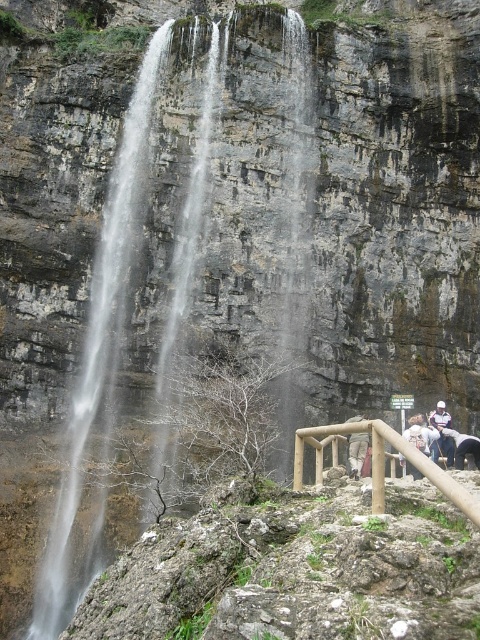
You are standing near the edge of the cliff and notice the clear water at center and the white leather jacket at lower right. Which object is located higher up in the scene?

The clear water at center is positioned over the white leather jacket at lower right, so it is higher up in the scene.

You are standing at the center of the rocky terrain in front of the waterfall. You need to place a small backpack on the ground near the white cotton jacket at lower right. Based on the coordinates provided, can you determine the direction you should walk from your current position to reach the jacket?

The white cotton jacket at lower right is located at coordinates point (442, 438). Since the jacket is at the lower right, you should walk towards the lower right direction from your current position at the center of the rocky terrain to reach it.

You are standing at the cliff edge near the waterfall. There are two points marked on the railing in front of you. The first point is at coordinates point (x=420, y=442) and the second point is at point (x=445, y=440). Which point is closer to you?

Point (x=420, y=442) is in front of point (x=445, y=440), so it is closer to you.